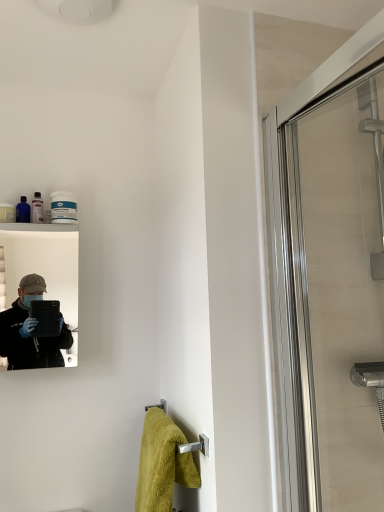
Question: From the image's perspective, is clear glass shower door at right on soft yellow towel at lower center?

Choices:
 (A) yes
 (B) no

Answer: (A)

Question: Can you confirm if clear glass shower door at right is wider than soft yellow towel at lower center?

Choices:
 (A) yes
 (B) no

Answer: (B)

Question: Is clear glass shower door at right looking in the opposite direction of soft yellow towel at lower center?

Choices:
 (A) yes
 (B) no

Answer: (B)

Question: Would you say clear glass shower door at right is outside soft yellow towel at lower center?

Choices:
 (A) no
 (B) yes

Answer: (B)

Question: Is clear glass shower door at right positioned far away from soft yellow towel at lower center?

Choices:
 (A) no
 (B) yes

Answer: (A)

Question: From a real-world perspective, is clear glass shower door at right positioned above or below soft yellow towel at lower center?

Choices:
 (A) above
 (B) below

Answer: (A)

Question: Looking at their shapes, would you say clear glass shower door at right is wider or thinner than soft yellow towel at lower center?

Choices:
 (A) wide
 (B) thin

Answer: (B)

Question: Is clear glass shower door at right taller or shorter than soft yellow towel at lower center?

Choices:
 (A) short
 (B) tall

Answer: (B)

Question: Visually, is clear glass shower door at right positioned to the left or to the right of soft yellow towel at lower center?

Choices:
 (A) right
 (B) left

Answer: (A)

Question: From a real-world perspective, relative to clear glass shower door at right, is soft yellow towel at lower center vertically above or below?

Choices:
 (A) above
 (B) below

Answer: (B)

Question: Is soft yellow towel at lower center inside the boundaries of clear glass shower door at right, or outside?

Choices:
 (A) outside
 (B) inside

Answer: (A)

Question: From the image's perspective, is soft yellow towel at lower center above or below clear glass shower door at right?

Choices:
 (A) above
 (B) below

Answer: (B)

Question: Based on their sizes in the image, would you say soft yellow towel at lower center is bigger or smaller than clear glass shower door at right?

Choices:
 (A) small
 (B) big

Answer: (A)

Question: From a real-world perspective, is clear glass shower door at right above or below matte black mirror at left?

Choices:
 (A) above
 (B) below

Answer: (B)

Question: In the image, is clear glass shower door at right positioned in front of or behind matte black mirror at left?

Choices:
 (A) behind
 (B) front

Answer: (B)